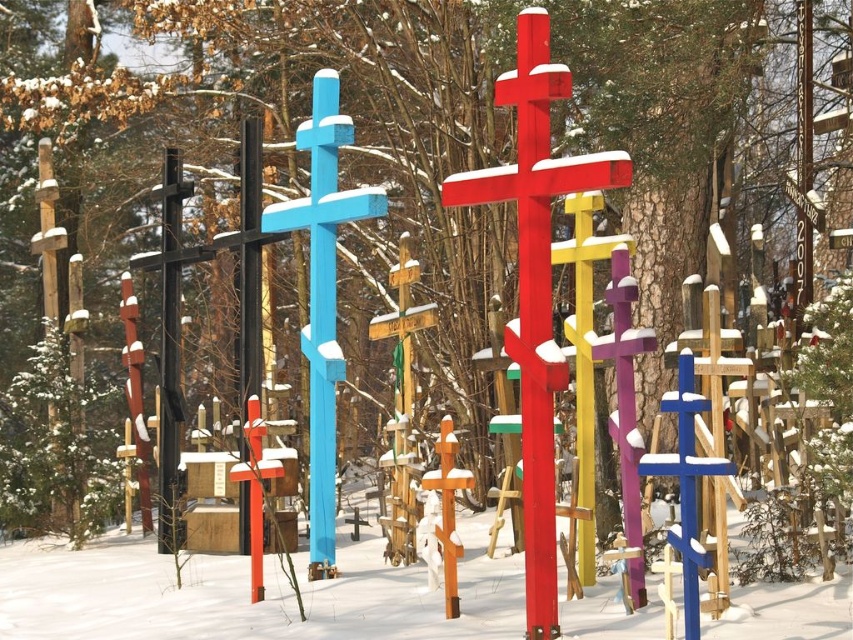
Question: Which of the following is the farthest from the observer?

Choices:
 (A) (450, 499)
 (B) (685, 637)

Answer: (A)

Question: Is blue painted wood cross at center below blue wooden cross at center-right?

Choices:
 (A) no
 (B) yes

Answer: (A)

Question: Can you confirm if smooth red wooden cross at center is wider than wooden cross at center?

Choices:
 (A) yes
 (B) no

Answer: (A)

Question: Which object is positioned closest to the blue painted wood cross at center?

Choices:
 (A) wooden cross at center
 (B) blue wooden cross at center-right

Answer: (A)

Question: Is blue painted wood cross at center further to the viewer compared to blue wooden cross at center-right?

Choices:
 (A) yes
 (B) no

Answer: (A)

Question: Which point appears farthest from the camera in this image?

Choices:
 (A) (318, 96)
 (B) (552, 72)
 (C) (682, 410)
 (D) (469, 486)

Answer: (A)